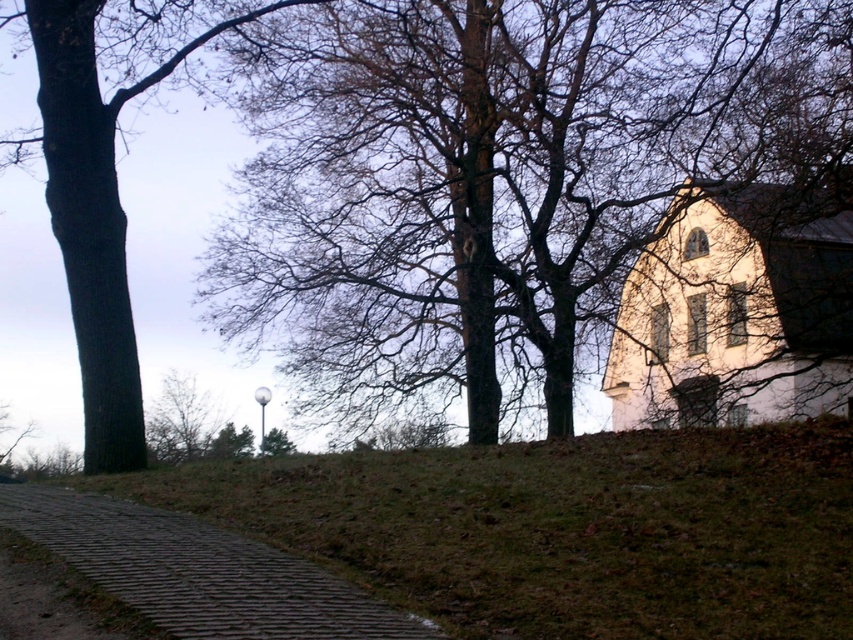
From the picture: You are a hiker standing at the start of the brown cobblestone path at lower left and want to reach the dark brown bark tree at left. Which direction should you walk to get closer to the tree?

The brown cobblestone path at lower left is positioned on the right side of the dark brown bark tree at left. To reach the tree, you should walk to the left along the path.

You are standing at the end of the brown cobblestone path at lower left and want to walk towards the dark brown bark tree at left. Which direction should you head?

The brown cobblestone path at lower left is located below the dark brown bark tree at left, so you should head upwards towards the dark brown bark tree at left.